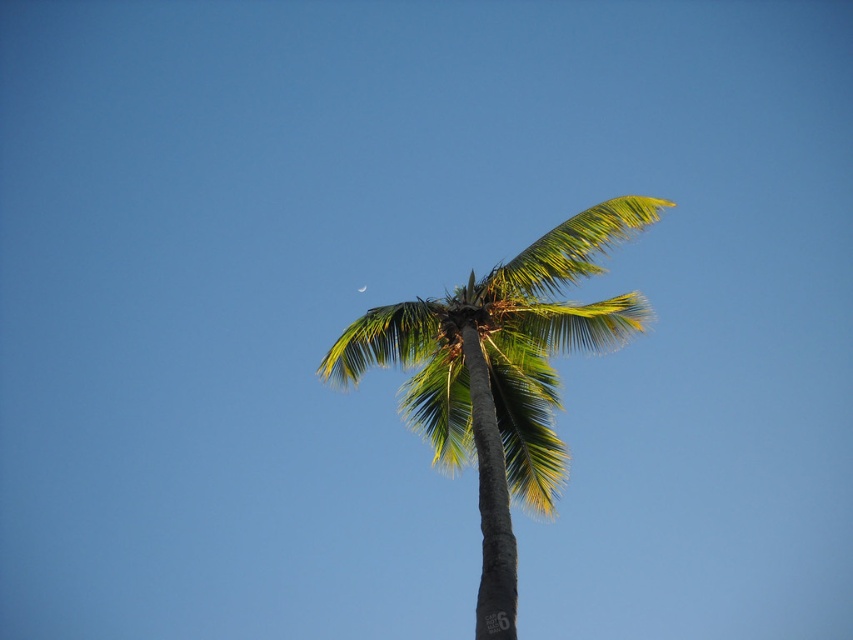
Which of these two, green leafy coconut tree at center or silvery reflective crescent at upper center, stands taller?

Standing taller between the two is green leafy coconut tree at center.

Identify the location of green leafy coconut tree at center. The height and width of the screenshot is (640, 853). (500, 374).

Who is more forward, (x=532, y=348) or (x=361, y=285)?

Positioned in front is point (x=532, y=348).

Where is `green leafy coconut tree at center`? The width and height of the screenshot is (853, 640). green leafy coconut tree at center is located at coordinates (500, 374).